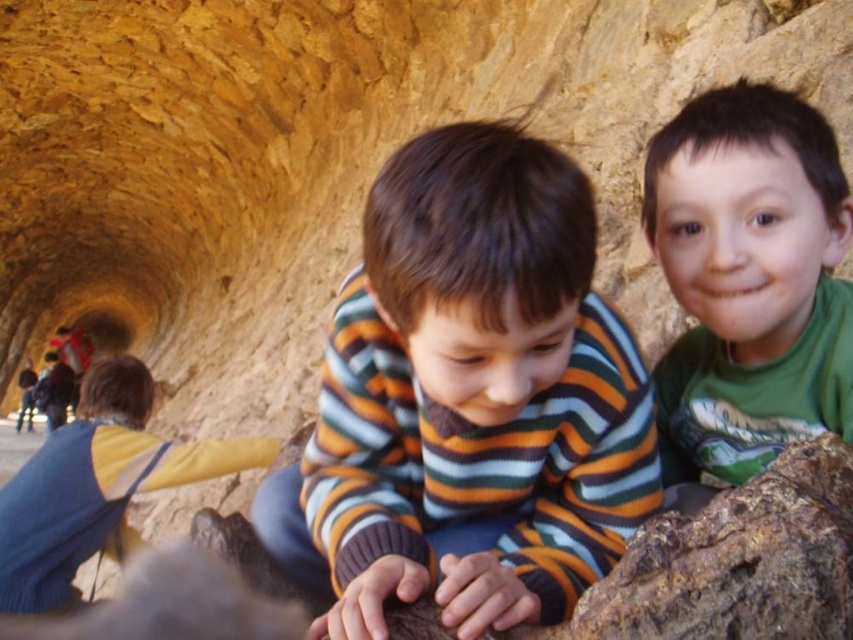
You are standing in a cave and see a boy wearing a striped sweater at center. If you want to give him a flashlight that is 1.5 meters long, can you reach him without moving closer?

The striped sweater at center and viewer are 4.01 meters apart. Since the flashlight is only 1.5 meters long, you cannot reach him without moving closer.

You are a photographer inside the rock tunnel. You want to take a photo that includes both the striped sweater at center and the green matte shirt at upper right. Based on their positions, where should you position your camera to ensure both are visible in the frame?

To capture both the striped sweater at center and the green matte shirt at upper right in the frame, position the camera below the green matte shirt at upper right since the striped sweater at center is located below it.

You are navigating through the rock tunnel and need to place a small marker at point [358,470] and another at point [718,106]. Which point is closer to the entrance of the tunnel?

Point [718,106] is closer to the entrance of the tunnel because it is in front of point [358,470], which is behind it.